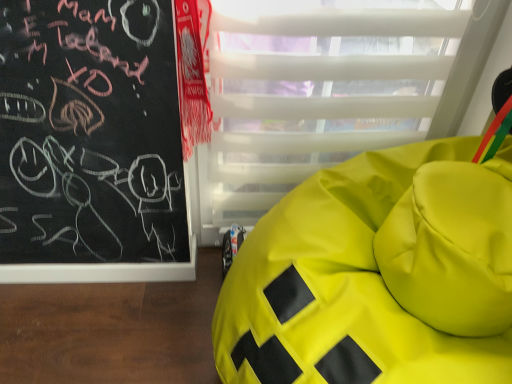
Question: Relative to lime green fabric bean bag at right, is transparent plastic glass door at center in front or behind?

Choices:
 (A) behind
 (B) front

Answer: (A)

Question: From a real-world perspective, is transparent plastic glass door at center positioned above or below lime green fabric bean bag at right?

Choices:
 (A) below
 (B) above

Answer: (B)

Question: Visually, is transparent plastic glass door at center positioned to the left or to the right of lime green fabric bean bag at right?

Choices:
 (A) right
 (B) left

Answer: (B)

Question: In the image, is lime green fabric bean bag at right positioned in front of or behind transparent plastic glass door at center?

Choices:
 (A) front
 (B) behind

Answer: (A)

Question: Is point (283, 223) positioned closer to the camera than point (312, 54)?

Choices:
 (A) farther
 (B) closer

Answer: (A)

Question: Looking at the image, does lime green fabric bean bag at right seem bigger or smaller compared to transparent plastic glass door at center?

Choices:
 (A) small
 (B) big

Answer: (B)

Question: Considering the positions of lime green fabric bean bag at right and transparent plastic glass door at center in the image, is lime green fabric bean bag at right taller or shorter than transparent plastic glass door at center?

Choices:
 (A) tall
 (B) short

Answer: (B)